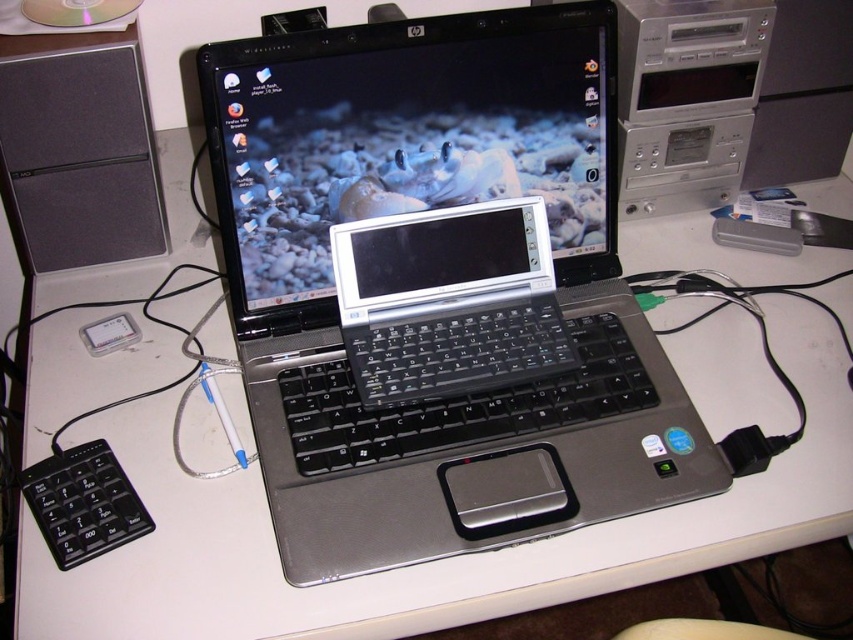
You are a delivery robot trying to navigate to a package located at point (x=502, y=490). There is an obstacle at point (x=480, y=145). Can you safely move to the package without hitting the obstacle?

Point (x=480, y=145) is behind point (x=502, y=490), so the obstacle is behind the package. Therefore, you can safely move to the package without hitting the obstacle.